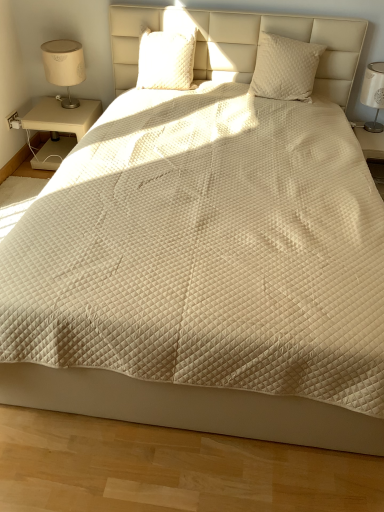
The image size is (384, 512). I want to click on beige fabric lampshade at left, so click(64, 67).

What is the approximate height of beige fabric lampshade at left?

The height of beige fabric lampshade at left is 14.94 inches.

Describe the element at coordinates (60, 128) in the screenshot. I see `beige wood nightstand at left` at that location.

Describe the element at coordinates (373, 93) in the screenshot. The image size is (384, 512). I see `white fabric lampshade at right` at that location.

At what (x,y) coordinates should I click in order to perform the action: click on white quilted fabric at right. Please return your answer as a coordinate pair (x, y). The height and width of the screenshot is (512, 384). Looking at the image, I should click on tap(372, 152).

Is beige wood nightstand at left positioned in front of white fabric lampshade at right?

No, it is behind white fabric lampshade at right.

Visually, is beige wood nightstand at left positioned to the left or to the right of white fabric lampshade at right?

In the image, beige wood nightstand at left appears on the left side of white fabric lampshade at right.

Does beige wood nightstand at left turn towards white fabric lampshade at right?

No, beige wood nightstand at left is not oriented towards white fabric lampshade at right.

Are beige wood nightstand at left and white fabric lampshade at right beside each other?

There is a gap between beige wood nightstand at left and white fabric lampshade at right.

In the image, is white fabric lampshade at right on the left side or the right side of beige wood nightstand at left?

white fabric lampshade at right is positioned on beige wood nightstand at left's right side.

Is white fabric lampshade at right oriented away from beige wood nightstand at left?

No, white fabric lampshade at right is not facing away from beige wood nightstand at left.

Consider the image. Is white fabric lampshade at right in contact with beige wood nightstand at left?

white fabric lampshade at right is not next to beige wood nightstand at left, and they're not touching.

How many degrees apart are the facing directions of quilted cream pillow at upper center, the second pillow from the right, and white quilted fabric at right?

The facing directions of quilted cream pillow at upper center, the second pillow from the right, and white quilted fabric at right are 6.31 degrees apart.

Is quilted cream pillow at upper center, placed as the 1th pillow when sorted from left to right, touching white quilted fabric at right?

No, quilted cream pillow at upper center, placed as the 1th pillow when sorted from left to right, is not with white quilted fabric at right.

Identify the location of pillow that is the 2nd object to the left of the white quilted fabric at right, starting at the anchor. (165, 60).

Is quilted cream pillow at upper center, the second pillow from the right, wider than white quilted fabric at right?

In fact, quilted cream pillow at upper center, the second pillow from the right, might be narrower than white quilted fabric at right.

Does point (381, 62) come closer to viewer compared to point (378, 151)?

No, it is behind (378, 151).

Which of these two, white fabric lampshade at right or white quilted fabric at right, is smaller?

With smaller size is white fabric lampshade at right.

Identify the location of table on the right of white fabric lampshade at right. (372, 152).

Considering the sizes of objects white fabric lampshade at right and white quilted fabric at right in the image provided, who is thinner, white fabric lampshade at right or white quilted fabric at right?

Thinner between the two is white fabric lampshade at right.

Considering the sizes of white fabric lampshade at right and quilted cream pillow at upper center, the second pillow from the right, in the image, is white fabric lampshade at right bigger or smaller than quilted cream pillow at upper center, the second pillow from the right,?

white fabric lampshade at right is bigger than quilted cream pillow at upper center, the second pillow from the right.

Can you confirm if white fabric lampshade at right is positioned to the right of quilted cream pillow at upper center, placed as the 1th pillow when sorted from left to right?

Yes, white fabric lampshade at right is to the right of quilted cream pillow at upper center, placed as the 1th pillow when sorted from left to right.

Which of these two, white fabric lampshade at right or quilted cream pillow at upper center, the second pillow from the right, is wider?

white fabric lampshade at right.

The height and width of the screenshot is (512, 384). I want to click on bedside lamp above the beige fabric lampshade at left (from a real-world perspective), so coord(373,93).

Which is closer, (59, 96) or (379, 105)?

Point (59, 96) is farther from the camera than point (379, 105).

Is beige fabric lampshade at left wider than white fabric lampshade at right?

Incorrect, the width of beige fabric lampshade at left does not surpass that of white fabric lampshade at right.

Based on the photo, how many degrees apart are the facing directions of beige fabric lampshade at left and white fabric lampshade at right?

The angle between the facing direction of beige fabric lampshade at left and the facing direction of white fabric lampshade at right is 1.48 degrees.

Does quilted cream pillow at upper center, placed as the 1th pillow when sorted from left to right, lie in front of beige wood nightstand at left?

Yes, quilted cream pillow at upper center, placed as the 1th pillow when sorted from left to right, is closer to the camera.

Which of these two, quilted cream pillow at upper center, the second pillow from the right, or beige wood nightstand at left, is thinner?

Thinner between the two is quilted cream pillow at upper center, the second pillow from the right.

Looking at the image, does quilted cream pillow at upper center, placed as the 1th pillow when sorted from left to right, seem bigger or smaller compared to beige wood nightstand at left?

In the image, quilted cream pillow at upper center, placed as the 1th pillow when sorted from left to right, appears to be smaller than beige wood nightstand at left.

Is quilted cream pillow at upper center, placed as the 1th pillow when sorted from left to right, not near beige wood nightstand at left?

That's not correct — quilted cream pillow at upper center, placed as the 1th pillow when sorted from left to right, is a little close to beige wood nightstand at left.

This screenshot has width=384, height=512. What are the coordinates of `nightstand below the white fabric lampshade at right (from the image's perspective)` in the screenshot? It's located at (60, 128).

Identify the location of bedside lamp located in front of the beige wood nightstand at left. Image resolution: width=384 pixels, height=512 pixels. (x=373, y=93).

When comparing their distances from quilted cream pillow at upper center, placed as the 1th pillow when sorted from left to right, does white quilted pillow at upper right, which is counted as the 1th pillow, starting from the right, or white quilted fabric at right seem closer?

white quilted pillow at upper right, which is counted as the 1th pillow, starting from the right, is positioned closer to the anchor quilted cream pillow at upper center, placed as the 1th pillow when sorted from left to right.

From the picture: When comparing their distances from beige wood nightstand at left, does beige fabric lampshade at left or quilted cream pillow at upper center, the second pillow from the right, seem closer?

beige fabric lampshade at left is closer to beige wood nightstand at left.

Which object lies further to the anchor point beige wood nightstand at left, white quilted fabric at right or white quilted pillow at upper right, the 2th pillow positioned from the left?

white quilted fabric at right is positioned further to the anchor beige wood nightstand at left.

From the image, which object appears to be nearer to beige wood nightstand at left, white fabric lampshade at right or white quilted fabric at right?

white quilted fabric at right.

From the image, which object appears to be nearer to white quilted fabric at right, beige wood nightstand at left or beige fabric lampshade at left?

Among the two, beige wood nightstand at left is located nearer to white quilted fabric at right.

Looking at the image, which one is located closer to white quilted fabric at right, quilted cream pillow at upper center, the second pillow from the right, or beige wood nightstand at left?

quilted cream pillow at upper center, the second pillow from the right, is positioned closer to the anchor white quilted fabric at right.

Considering their positions, is quilted cream pillow at upper center, the second pillow from the right, positioned further to white quilted pillow at upper right, which is counted as the 1th pillow, starting from the right, than beige wood nightstand at left?

The object further to white quilted pillow at upper right, which is counted as the 1th pillow, starting from the right, is beige wood nightstand at left.

From the image, which object appears to be nearer to white quilted pillow at upper right, the 2th pillow positioned from the left, beige fabric lampshade at left or white quilted fabric at right?

Based on the image, white quilted fabric at right appears to be nearer to white quilted pillow at upper right, the 2th pillow positioned from the left.

Image resolution: width=384 pixels, height=512 pixels. In order to click on table lamp between beige wood nightstand at left and white quilted fabric at right from left to right in this screenshot , I will do `click(64, 67)`.

This screenshot has width=384, height=512. I want to click on bedside lamp situated between quilted cream pillow at upper center, placed as the 1th pillow when sorted from left to right, and white quilted fabric at right from left to right, so click(373, 93).

This screenshot has height=512, width=384. I want to click on table lamp between beige wood nightstand at left and white quilted pillow at upper right, which is counted as the 1th pillow, starting from the right, so click(64, 67).

Locate an element on the screen. The height and width of the screenshot is (512, 384). bedside lamp between white quilted pillow at upper right, which is counted as the 1th pillow, starting from the right, and white quilted fabric at right from left to right is located at coordinates (373, 93).